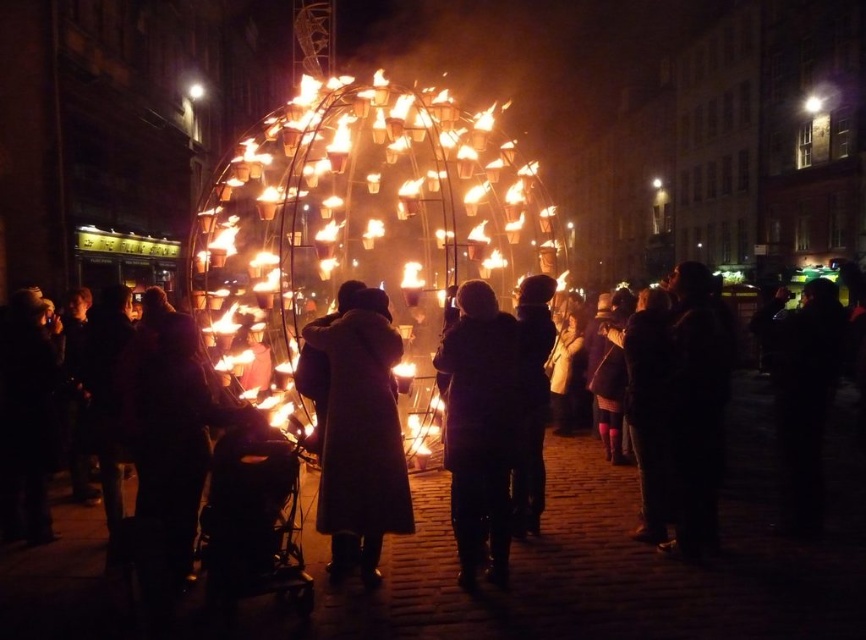
Question: Does matte black coat at center have a greater width compared to dark gray coat at center?

Choices:
 (A) yes
 (B) no

Answer: (A)

Question: Estimate the real-world distances between objects in this image. Which object is closer to the dark wool coat at center?

Choices:
 (A) dark gray coat at center
 (B) matte black coat at center

Answer: (A)

Question: Which object is closer to the camera taking this photo?

Choices:
 (A) matte black coat at center
 (B) dark gray coat at center
 (C) dark wool coat at center

Answer: (A)

Question: Where is matte black coat at center located in relation to dark gray coat at center in the image?

Choices:
 (A) above
 (B) below

Answer: (B)

Question: Is the position of dark wool coat at center more distant than that of dark gray coat at center?

Choices:
 (A) no
 (B) yes

Answer: (A)

Question: Which of the following is the farthest from the observer?

Choices:
 (A) (364, 422)
 (B) (519, 588)
 (C) (477, 460)

Answer: (C)